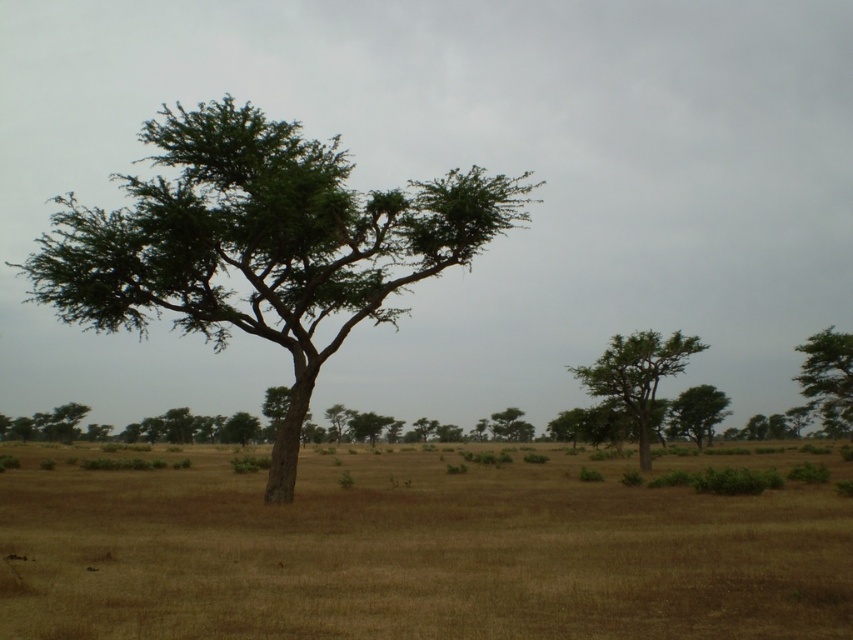
Question: Which object is the farthest from the green rough bark tree at right?

Choices:
 (A) green leafy tree at center
 (B) green leafy tree at center-right
 (C) green leafy tree at right

Answer: (A)

Question: Which point is closer to the camera?

Choices:
 (A) (705, 396)
 (B) (264, 161)
 (C) (850, 340)

Answer: (B)

Question: Is green leafy tree at right wider than green leafy tree at center-right?

Choices:
 (A) yes
 (B) no

Answer: (A)

Question: Which of the following is the farthest from the observer?

Choices:
 (A) (677, 397)
 (B) (608, 385)
 (C) (819, 342)
 (D) (281, 264)

Answer: (A)

Question: Is green leafy tree at center thinner than green rough bark tree at right?

Choices:
 (A) no
 (B) yes

Answer: (A)

Question: Can you confirm if green leafy tree at center is thinner than green leafy tree at right?

Choices:
 (A) yes
 (B) no

Answer: (B)